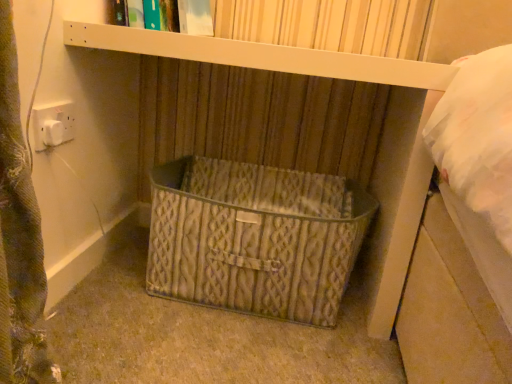
Question: Which is correct: rustic metal basket at center is inside hardcover book at upper center, or outside of it?

Choices:
 (A) outside
 (B) inside

Answer: (A)

Question: Considering their positions, is rustic metal basket at center located in front of or behind hardcover book at upper center?

Choices:
 (A) front
 (B) behind

Answer: (A)

Question: Is point (173, 238) positioned closer to the camera than point (192, 14)?

Choices:
 (A) closer
 (B) farther

Answer: (A)

Question: Visually, is hardcover book at upper center positioned to the left or to the right of rustic metal basket at center?

Choices:
 (A) left
 (B) right

Answer: (A)

Question: Which is correct: hardcover book at upper center is inside rustic metal basket at center, or outside of it?

Choices:
 (A) outside
 (B) inside

Answer: (A)

Question: Based on their sizes in the image, would you say hardcover book at upper center is bigger or smaller than rustic metal basket at center?

Choices:
 (A) big
 (B) small

Answer: (B)

Question: Is point (143, 18) positioned closer to the camera than point (214, 190)?

Choices:
 (A) closer
 (B) farther

Answer: (A)